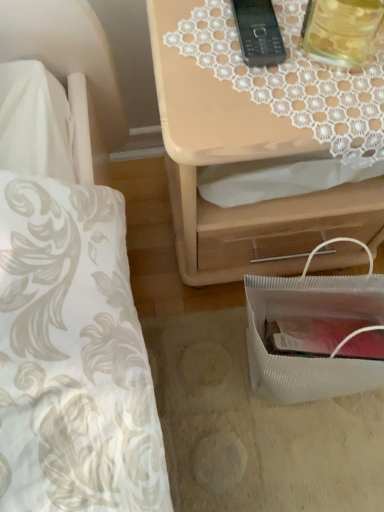
Question: Can you confirm if white textured bag at lower right is positioned to the left of translucent glass jar at upper right?

Choices:
 (A) no
 (B) yes

Answer: (A)

Question: Is white textured bag at lower right thinner than translucent glass jar at upper right?

Choices:
 (A) yes
 (B) no

Answer: (B)

Question: Would you say white textured bag at lower right is a long distance from translucent glass jar at upper right?

Choices:
 (A) no
 (B) yes

Answer: (A)

Question: Considering the relative positions of white textured bag at lower right and translucent glass jar at upper right in the image provided, is white textured bag at lower right behind translucent glass jar at upper right?

Choices:
 (A) yes
 (B) no

Answer: (A)

Question: From the image's perspective, would you say white textured bag at lower right is shown under translucent glass jar at upper right?

Choices:
 (A) yes
 (B) no

Answer: (A)

Question: Considering the relative positions of white textured bag at lower right and translucent glass jar at upper right in the image provided, is white textured bag at lower right to the right of translucent glass jar at upper right from the viewer's perspective?

Choices:
 (A) yes
 (B) no

Answer: (A)

Question: Is black plastic phone at upper center located outside white textured bag at lower right?

Choices:
 (A) yes
 (B) no

Answer: (A)

Question: Is black plastic phone at upper center oriented away from white textured bag at lower right?

Choices:
 (A) yes
 (B) no

Answer: (B)

Question: Can you confirm if black plastic phone at upper center is wider than white textured bag at lower right?

Choices:
 (A) yes
 (B) no

Answer: (B)

Question: From a real-world perspective, is black plastic phone at upper center on white textured bag at lower right?

Choices:
 (A) yes
 (B) no

Answer: (A)

Question: From the image's perspective, would you say black plastic phone at upper center is shown under white textured bag at lower right?

Choices:
 (A) yes
 (B) no

Answer: (B)

Question: From the image's perspective, does black plastic phone at upper center appear higher than white textured bag at lower right?

Choices:
 (A) no
 (B) yes

Answer: (B)

Question: From a real-world perspective, is light wood/texture nightstand at upper right located higher than black plastic phone at upper center?

Choices:
 (A) no
 (B) yes

Answer: (A)